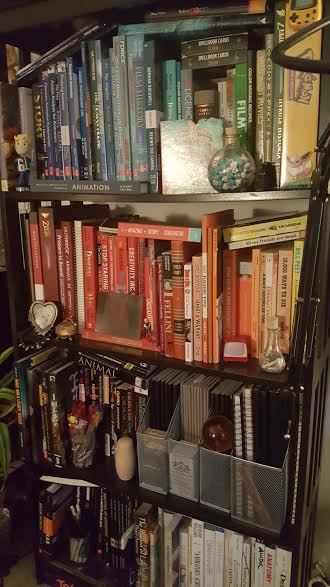
Identify the location of floor. The image size is (330, 587). (17, 573).